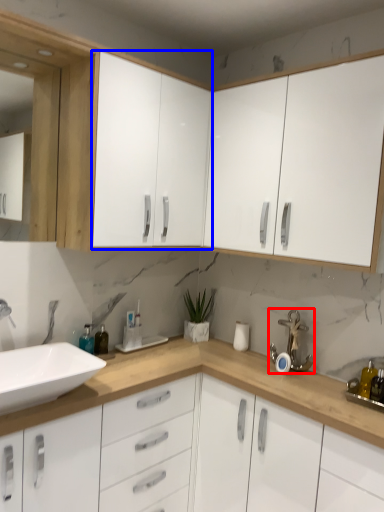
Question: Among these objects, which one is nearest to the camera, faucet (highlighted by a red box) or cabinetry (highlighted by a blue box)?

Choices:
 (A) faucet
 (B) cabinetry

Answer: (B)